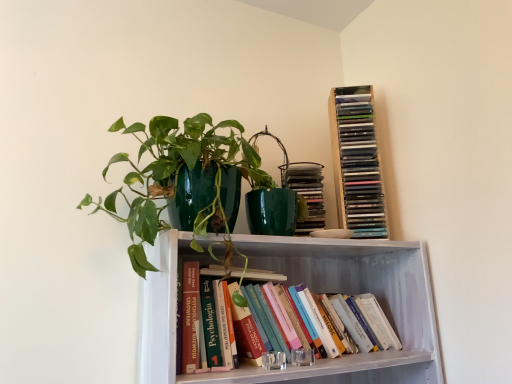
The image size is (512, 384). What do you see at coordinates (361, 321) in the screenshot?
I see `hardcover books at center, positioned as the 4th book in top-to-bottom order` at bounding box center [361, 321].

What do you see at coordinates (356, 162) in the screenshot?
I see `wooden cd tower at upper right, marked as the 4th book in a bottom-to-top arrangement` at bounding box center [356, 162].

What are the coordinates of `hardcover books at center, positioned as the 4th book in top-to-bottom order` in the screenshot? It's located at (361, 321).

From the hardcover book at center, which is the 2th book in bottom-to-top order, count 3rd book to the right and point to it. Please provide its 2D coordinates.

[(356, 162)]

Could you measure the distance between hardcover book at center, marked as the 3th book in a top-to-bottom arrangement, and wooden cd tower at upper right, marked as the 4th book in a bottom-to-top arrangement?

hardcover book at center, marked as the 3th book in a top-to-bottom arrangement, and wooden cd tower at upper right, marked as the 4th book in a bottom-to-top arrangement, are 19.37 inches apart.

From the image's perspective, between hardcover book at center, which is the 2th book in bottom-to-top order, and wooden cd tower at upper right, marked as the 4th book in a bottom-to-top arrangement, who is located below?

hardcover book at center, which is the 2th book in bottom-to-top order, is shown below in the image.

Which of these two, hardcover book at center, which is the 2th book in bottom-to-top order, or wooden cd tower at upper right, which appears as the 1th book when viewed from the top, is bigger?

wooden cd tower at upper right, which appears as the 1th book when viewed from the top, is bigger.

Which is in front, point (304, 228) or point (214, 377)?

The point (214, 377) is closer.

Consider the image. Is hardcover books at center, positioned as the 4th book in top-to-bottom order, at the back of matte green book at upper right, marked as the third book in a bottom-to-top arrangement?

That's not correct — matte green book at upper right, marked as the third book in a bottom-to-top arrangement, is not looking away from hardcover books at center, positioned as the 4th book in top-to-bottom order.

Does matte green book at upper right, acting as the 2th book starting from the top, have a greater width compared to hardcover books at center, which is the first book in bottom-to-top order?

Incorrect, the width of matte green book at upper right, acting as the 2th book starting from the top, does not surpass that of hardcover books at center, which is the first book in bottom-to-top order.

From the image's perspective, who appears lower, matte green book at upper right, marked as the third book in a bottom-to-top arrangement, or hardcover books at center, which is the first book in bottom-to-top order?

hardcover books at center, which is the first book in bottom-to-top order.

Considering the positions of points (349, 217) and (268, 279), is point (349, 217) farther from camera compared to point (268, 279)?

Yes.

Could you measure the distance between wooden cd tower at upper right, marked as the 4th book in a bottom-to-top arrangement, and hardcover book at center, marked as the 3th book in a top-to-bottom arrangement?

They are 19.37 inches apart.

From the image's perspective, is wooden cd tower at upper right, which appears as the 1th book when viewed from the top, on hardcover book at center, marked as the 3th book in a top-to-bottom arrangement?

Yes, from the image's perspective, wooden cd tower at upper right, which appears as the 1th book when viewed from the top, is on top of hardcover book at center, marked as the 3th book in a top-to-bottom arrangement.

Are wooden cd tower at upper right, marked as the 4th book in a bottom-to-top arrangement, and hardcover book at center, which is the 2th book in bottom-to-top order, making contact?

wooden cd tower at upper right, marked as the 4th book in a bottom-to-top arrangement, and hardcover book at center, which is the 2th book in bottom-to-top order, are clearly separated.

Does green glossy pot at upper center appear on the left side of wooden cd tower at upper right, which appears as the 1th book when viewed from the top?

Yes, green glossy pot at upper center is to the left of wooden cd tower at upper right, which appears as the 1th book when viewed from the top.

From the image's perspective, between green glossy pot at upper center and wooden cd tower at upper right, which appears as the 1th book when viewed from the top, which one is located above?

wooden cd tower at upper right, which appears as the 1th book when viewed from the top, appears higher in the image.

From a real-world perspective, who is located lower, green glossy pot at upper center or wooden cd tower at upper right, marked as the 4th book in a bottom-to-top arrangement?

green glossy pot at upper center is physically lower.

Measure the distance between hardcover books at center, which is the first book in bottom-to-top order, and green glossy pot at upper center.

16.73 inches.

From the image's perspective, which is below, hardcover books at center, which is the first book in bottom-to-top order, or green glossy pot at upper center?

hardcover books at center, which is the first book in bottom-to-top order, appears lower in the image.

Is hardcover books at center, positioned as the 4th book in top-to-bottom order, spatially inside green glossy pot at upper center, or outside of it?

The correct answer is: outside.

Is hardcover books at center, which is the first book in bottom-to-top order, touching green glossy pot at upper center?

hardcover books at center, which is the first book in bottom-to-top order, is not next to green glossy pot at upper center, and they're not touching.

Is green glossy pot at upper center oriented away from hardcover book at center, which is the 2th book in bottom-to-top order?

No, green glossy pot at upper center is not facing away from hardcover book at center, which is the 2th book in bottom-to-top order.

Would you consider green glossy pot at upper center to be distant from hardcover book at center, marked as the 3th book in a top-to-bottom arrangement?

green glossy pot at upper center is near hardcover book at center, marked as the 3th book in a top-to-bottom arrangement, not far away.

Consider the image. From a real-world perspective, who is located higher, green glossy pot at upper center or hardcover book at center, marked as the 3th book in a top-to-bottom arrangement?

green glossy pot at upper center.

Which object is further away from the camera, green glossy pot at upper center or hardcover book at center, marked as the 3th book in a top-to-bottom arrangement?

Positioned behind is hardcover book at center, marked as the 3th book in a top-to-bottom arrangement.

Considering the relative positions of wooden cd tower at upper right, which appears as the 1th book when viewed from the top, and hardcover books at center, which is the first book in bottom-to-top order, in the image provided, is wooden cd tower at upper right, which appears as the 1th book when viewed from the top, to the right of hardcover books at center, which is the first book in bottom-to-top order, from the viewer's perspective?

Yes, wooden cd tower at upper right, which appears as the 1th book when viewed from the top, is to the right of hardcover books at center, which is the first book in bottom-to-top order.

From a real-world perspective, which is physically above, wooden cd tower at upper right, marked as the 4th book in a bottom-to-top arrangement, or hardcover books at center, positioned as the 4th book in top-to-bottom order?

wooden cd tower at upper right, marked as the 4th book in a bottom-to-top arrangement, is physically above.

Based on the photo, considering the relative sizes of wooden cd tower at upper right, which appears as the 1th book when viewed from the top, and hardcover books at center, which is the first book in bottom-to-top order, in the image provided, is wooden cd tower at upper right, which appears as the 1th book when viewed from the top, wider than hardcover books at center, which is the first book in bottom-to-top order,?

No, wooden cd tower at upper right, which appears as the 1th book when viewed from the top, is not wider than hardcover books at center, which is the first book in bottom-to-top order.

Considering the sizes of objects wooden cd tower at upper right, which appears as the 1th book when viewed from the top, and hardcover books at center, which is the first book in bottom-to-top order, in the image provided, who is bigger, wooden cd tower at upper right, which appears as the 1th book when viewed from the top, or hardcover books at center, which is the first book in bottom-to-top order,?

hardcover books at center, which is the first book in bottom-to-top order, is bigger.

At what (x,y) coordinates should I click in order to perform the action: click on the 2nd book above the hardcover book at center, marked as the 3th book in a top-to-bottom arrangement (from the image's perspective). Please return your answer as a coordinate pair (x, y). The width and height of the screenshot is (512, 384). Looking at the image, I should click on (356, 162).

From a real-world perspective, starting from the matte green book at upper right, acting as the 2th book starting from the top, which book is the 2nd one below it? Please provide its 2D coordinates.

[(361, 321)]

When comparing their distances from hardcover books at center, positioned as the 4th book in top-to-bottom order, does wooden cd tower at upper right, which appears as the 1th book when viewed from the top, or hardcover book at center, which is the 2th book in bottom-to-top order, seem closer?

The object closer to hardcover books at center, positioned as the 4th book in top-to-bottom order, is hardcover book at center, which is the 2th book in bottom-to-top order.

When comparing their distances from green glossy pot at upper center, does matte green book at upper right, marked as the third book in a bottom-to-top arrangement, or wooden cd tower at upper right, which appears as the 1th book when viewed from the top, seem closer?

matte green book at upper right, marked as the third book in a bottom-to-top arrangement, is closer to green glossy pot at upper center.

Estimate the real-world distances between objects in this image. Which object is closer to hardcover books at center, which is the first book in bottom-to-top order, matte green book at upper right, acting as the 2th book starting from the top, or green glossy pot at upper center?

The object closer to hardcover books at center, which is the first book in bottom-to-top order, is matte green book at upper right, acting as the 2th book starting from the top.

Which object lies further to the anchor point wooden cd tower at upper right, which appears as the 1th book when viewed from the top, matte green book at upper right, acting as the 2th book starting from the top, or green glossy pot at upper center?

green glossy pot at upper center is positioned further to the anchor wooden cd tower at upper right, which appears as the 1th book when viewed from the top.

Based on their spatial positions, is hardcover book at center, which is the 2th book in bottom-to-top order, or hardcover books at center, positioned as the 4th book in top-to-bottom order, further from green glossy pot at upper center?

Among the two, hardcover books at center, positioned as the 4th book in top-to-bottom order, is located further to green glossy pot at upper center.

Estimate the real-world distances between objects in this image. Which object is further from wooden cd tower at upper right, marked as the 4th book in a bottom-to-top arrangement, green glossy pot at upper center or matte green book at upper right, acting as the 2th book starting from the top?

The object further to wooden cd tower at upper right, marked as the 4th book in a bottom-to-top arrangement, is green glossy pot at upper center.

Which object lies further to the anchor point hardcover book at center, marked as the 3th book in a top-to-bottom arrangement, wooden cd tower at upper right, which appears as the 1th book when viewed from the top, or hardcover books at center, which is the first book in bottom-to-top order?

wooden cd tower at upper right, which appears as the 1th book when viewed from the top, lies further to hardcover book at center, marked as the 3th book in a top-to-bottom arrangement, than the other object.

Considering their positions, is hardcover book at center, which is the 2th book in bottom-to-top order, positioned further to matte green book at upper right, marked as the third book in a bottom-to-top arrangement, than green glossy pot at upper center?

green glossy pot at upper center is further to matte green book at upper right, marked as the third book in a bottom-to-top arrangement.

Identify the location of book between matte green book at upper right, marked as the third book in a bottom-to-top arrangement, and hardcover books at center, positioned as the 4th book in top-to-bottom order, from top to bottom. The height and width of the screenshot is (384, 512). (257, 275).

The image size is (512, 384). Find the location of `book positioned between green glossy pot at upper center and hardcover book at center, marked as the 3th book in a top-to-bottom arrangement, from near to far`. book positioned between green glossy pot at upper center and hardcover book at center, marked as the 3th book in a top-to-bottom arrangement, from near to far is located at coordinates (361, 321).